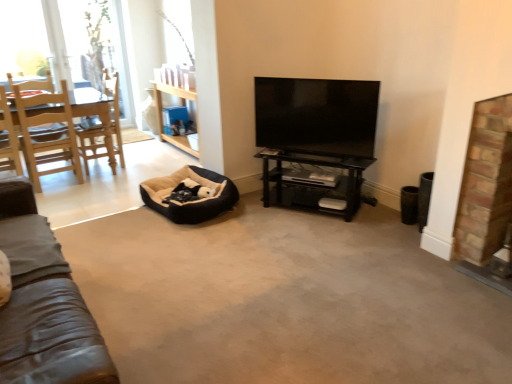
Image resolution: width=512 pixels, height=384 pixels. What do you see at coordinates (317, 116) in the screenshot?
I see `flat screen tv at center` at bounding box center [317, 116].

Find the location of a particular element. The height and width of the screenshot is (384, 512). black glossy shelf at center is located at coordinates (314, 182).

The image size is (512, 384). Identify the location of wooden chair at left, the second chair positioned from the left. (47, 130).

Is black glossy shelf at center positioned with its back to beige plush bean bag at center?

No, black glossy shelf at center is not facing away from beige plush bean bag at center.

Is black glossy shelf at center at the left side of beige plush bean bag at center?

No, black glossy shelf at center is not to the left of beige plush bean bag at center.

Which of these two, black glossy shelf at center or beige plush bean bag at center, stands taller?

Standing taller between the two is black glossy shelf at center.

In the scene shown: From a real-world perspective, is light wood chair at left, which is the first chair in left-to-right order, positioned under wooden chair at left, the 1th chair positioned from the right, based on gravity?

Result: No, from a real-world perspective, light wood chair at left, which is the first chair in left-to-right order, is not under wooden chair at left, the 1th chair positioned from the right.

Does point (12, 132) come farther from viewer compared to point (82, 176)?

No, it is in front of (82, 176).

Can we say light wood chair at left, the 2th chair when ordered from right to left, lies outside wooden chair at left, the second chair positioned from the left?

No, light wood chair at left, the 2th chair when ordered from right to left, is inside or overlapping with wooden chair at left, the second chair positioned from the left.

Looking at this image, is light wood chair at left, which is the first chair in left-to-right order, aimed at wooden chair at left, the 1th chair positioned from the right?

Yes, light wood chair at left, which is the first chair in left-to-right order, is aimed at wooden chair at left, the 1th chair positioned from the right.

Between beige plush bean bag at center and flat screen tv at center, which one has smaller size?

flat screen tv at center is smaller.

Can you confirm if beige plush bean bag at center is shorter than flat screen tv at center?

Indeed, beige plush bean bag at center has a lesser height compared to flat screen tv at center.

Could you tell me if beige plush bean bag at center is facing flat screen tv at center?

No, beige plush bean bag at center is not oriented towards flat screen tv at center.

From a real-world perspective, does beige plush bean bag at center sit lower than light wood chair at left, which is the first chair in left-to-right order?

Indeed, from a real-world perspective, beige plush bean bag at center is positioned beneath light wood chair at left, which is the first chair in left-to-right order.

From the image's perspective, is beige plush bean bag at center under light wood chair at left, which is the first chair in left-to-right order?

Yes, from the image's perspective, beige plush bean bag at center is below light wood chair at left, which is the first chair in left-to-right order.

From the picture: Is light wood chair at left, the 2th chair when ordered from right to left, at the back of beige plush bean bag at center?

No, beige plush bean bag at center is not facing away from light wood chair at left, the 2th chair when ordered from right to left.

Which of these two, beige plush bean bag at center or light wood chair at left, the 2th chair when ordered from right to left, is bigger?

beige plush bean bag at center is bigger.

Considering the sizes of objects flat screen tv at center and wooden chair at left, the 1th chair positioned from the right, in the image provided, who is smaller, flat screen tv at center or wooden chair at left, the 1th chair positioned from the right,?

Smaller between the two is flat screen tv at center.

Between flat screen tv at center and wooden chair at left, the second chair positioned from the left, which one appears on the left side from the viewer's perspective?

Positioned to the left is wooden chair at left, the second chair positioned from the left.

Is wooden chair at left, the second chair positioned from the left, at the back of flat screen tv at center?

flat screen tv at center does not have its back to wooden chair at left, the second chair positioned from the left.

Is flat screen tv at center not near wooden chair at left, the 1th chair positioned from the right?

flat screen tv at center is far away from wooden chair at left, the 1th chair positioned from the right.

The height and width of the screenshot is (384, 512). Identify the location of bean bag chair below the wooden chair at left, the second chair positioned from the left (from a real-world perspective). (193, 201).

Which is more to the right, beige plush bean bag at center or wooden chair at left, the second chair positioned from the left?

beige plush bean bag at center is more to the right.

Which of these two, beige plush bean bag at center or wooden chair at left, the 1th chair positioned from the right, is bigger?

With larger size is wooden chair at left, the 1th chair positioned from the right.

Measure the distance from beige plush bean bag at center to wooden chair at left, the 1th chair positioned from the right.

The distance of beige plush bean bag at center from wooden chair at left, the 1th chair positioned from the right, is 1.18 meters.

Is flat screen tv at center taller or shorter than brick fireplace at right?

Clearly, flat screen tv at center is shorter compared to brick fireplace at right.

From the image's perspective, which object appears higher, flat screen tv at center or brick fireplace at right?

flat screen tv at center, from the image's perspective.

Image resolution: width=512 pixels, height=384 pixels. I want to click on television above the brick fireplace at right (from the image's perspective), so click(317, 116).

Is point (298, 98) behind point (464, 248)?

Yes.

Find the location of a particular element. bean bag chair that appears below the black glossy shelf at center (from a real-world perspective) is located at coordinates (193, 201).

Find the location of a particular element. This screenshot has width=512, height=384. chair to the right of light wood chair at left, which is the first chair in left-to-right order is located at coordinates (47, 130).

Which object lies further to the anchor point black glossy shelf at center, light wood chair at left, which is the first chair in left-to-right order, or brick fireplace at right?

light wood chair at left, which is the first chair in left-to-right order, is positioned further to the anchor black glossy shelf at center.

Based on the photo, from the image, which object appears to be nearer to brick fireplace at right, black glossy shelf at center or wooden chair at left, the second chair positioned from the left?

black glossy shelf at center is closer to brick fireplace at right.

Estimate the real-world distances between objects in this image. Which object is closer to wooden chair at left, the second chair positioned from the left, light wood chair at left, which is the first chair in left-to-right order, or black glossy shelf at center?

light wood chair at left, which is the first chair in left-to-right order, is closer to wooden chair at left, the second chair positioned from the left.

Based on their spatial positions, is black glossy shelf at center or brick fireplace at right further from flat screen tv at center?

brick fireplace at right is positioned further to the anchor flat screen tv at center.

Looking at the image, which one is located further to black glossy shelf at center, wooden chair at left, the 1th chair positioned from the right, or beige plush bean bag at center?

Based on the image, wooden chair at left, the 1th chair positioned from the right, appears to be further to black glossy shelf at center.

From the image, which object appears to be farther from beige plush bean bag at center, flat screen tv at center or black glossy shelf at center?

The object further to beige plush bean bag at center is flat screen tv at center.

Which object lies further to the anchor point wooden chair at left, the 1th chair positioned from the right, brick fireplace at right or black glossy shelf at center?

The object further to wooden chair at left, the 1th chair positioned from the right, is brick fireplace at right.

From the image, which object appears to be farther from flat screen tv at center, light wood chair at left, which is the first chair in left-to-right order, or beige plush bean bag at center?

Among the two, light wood chair at left, which is the first chair in left-to-right order, is located further to flat screen tv at center.

The image size is (512, 384). Identify the location of shelf located between wooden chair at left, the 1th chair positioned from the right, and brick fireplace at right in the left-right direction. (x=314, y=182).

I want to click on television situated between light wood chair at left, the 2th chair when ordered from right to left, and black glossy shelf at center from left to right, so click(317, 116).

Image resolution: width=512 pixels, height=384 pixels. Identify the location of chair between light wood chair at left, the 2th chair when ordered from right to left, and brick fireplace at right. (47, 130).

The image size is (512, 384). Identify the location of shelf located between light wood chair at left, the 2th chair when ordered from right to left, and brick fireplace at right in the left-right direction. (314, 182).